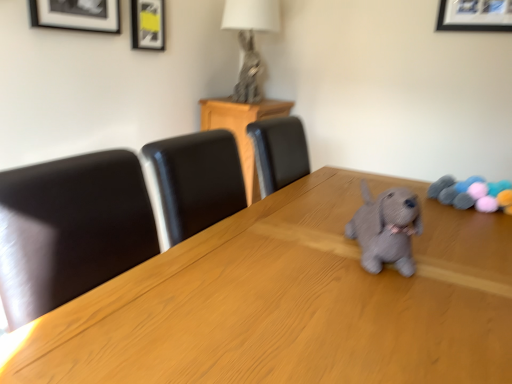
The image size is (512, 384). I want to click on free space to the back side of gray knitted dog at center, so click(x=325, y=218).